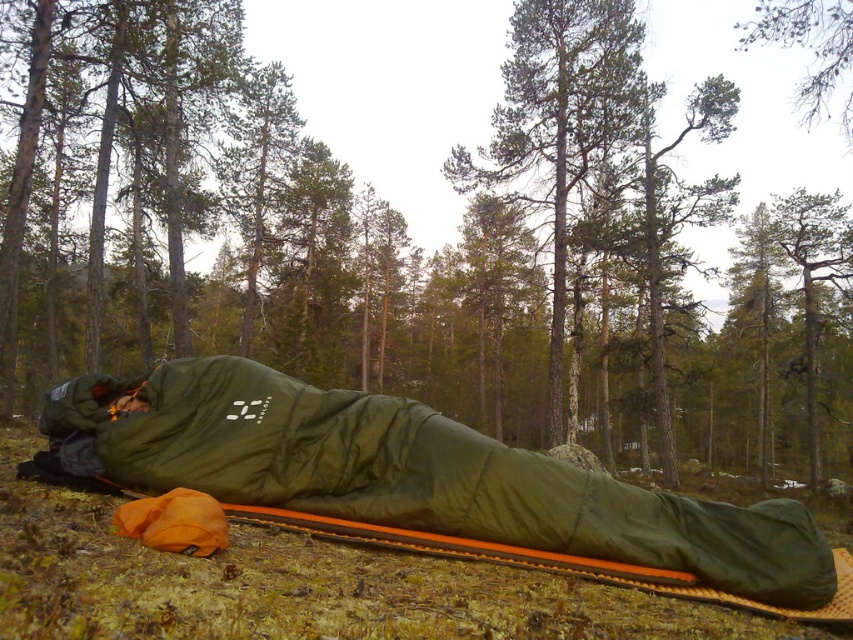
Question: Based on their relative distances, which object is farther from the olive green fabric sleeping bag at center?

Choices:
 (A) green matte tree at upper center
 (B) green textured tree at center

Answer: (B)

Question: Can you confirm if green textured tree at center is positioned to the right of green matte tree at upper center?

Choices:
 (A) yes
 (B) no

Answer: (B)

Question: Can you confirm if green textured tree at center is bigger than green matte tree at upper center?

Choices:
 (A) no
 (B) yes

Answer: (A)

Question: Does green textured tree at center appear on the left side of green matte tree at upper center?

Choices:
 (A) yes
 (B) no

Answer: (A)

Question: Which point is closer to the camera?

Choices:
 (A) green matte tree at upper center
 (B) olive green fabric sleeping bag at center
 (C) green textured tree at center

Answer: (B)

Question: Which of the following is the farthest from the observer?

Choices:
 (A) olive green fabric sleeping bag at center
 (B) green matte tree at upper center
 (C) green textured tree at center

Answer: (C)